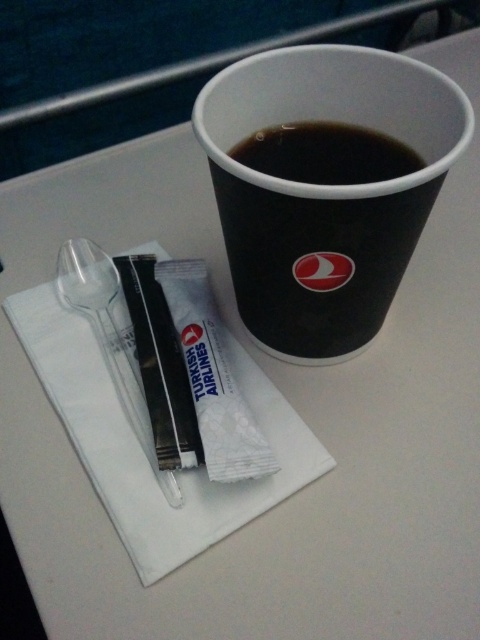
Question: Among these objects, which one is nearest to the camera?

Choices:
 (A) transparent plastic spoon at left
 (B) black paper cup at upper center

Answer: (B)

Question: Is transparent plastic spoon at left smaller than black matte cup at upper center?

Choices:
 (A) no
 (B) yes

Answer: (A)

Question: Which of these objects is positioned farthest from the black matte cup at upper center?

Choices:
 (A) black paper cup at upper center
 (B) transparent plastic spoon at left

Answer: (B)

Question: Can you confirm if transparent plastic spoon at left is positioned to the right of black matte cup at upper center?

Choices:
 (A) yes
 (B) no

Answer: (B)

Question: Does black paper cup at upper center appear under black matte cup at upper center?

Choices:
 (A) yes
 (B) no

Answer: (A)

Question: Which object appears farthest from the camera in this image?

Choices:
 (A) transparent plastic spoon at left
 (B) black paper cup at upper center

Answer: (A)